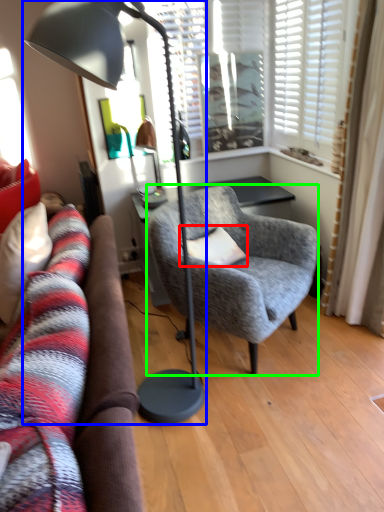
Question: Which is farther away from pillow (highlighted by a red box)? lamp (highlighted by a blue box) or chair (highlighted by a green box)?

Choices:
 (A) lamp
 (B) chair

Answer: (A)